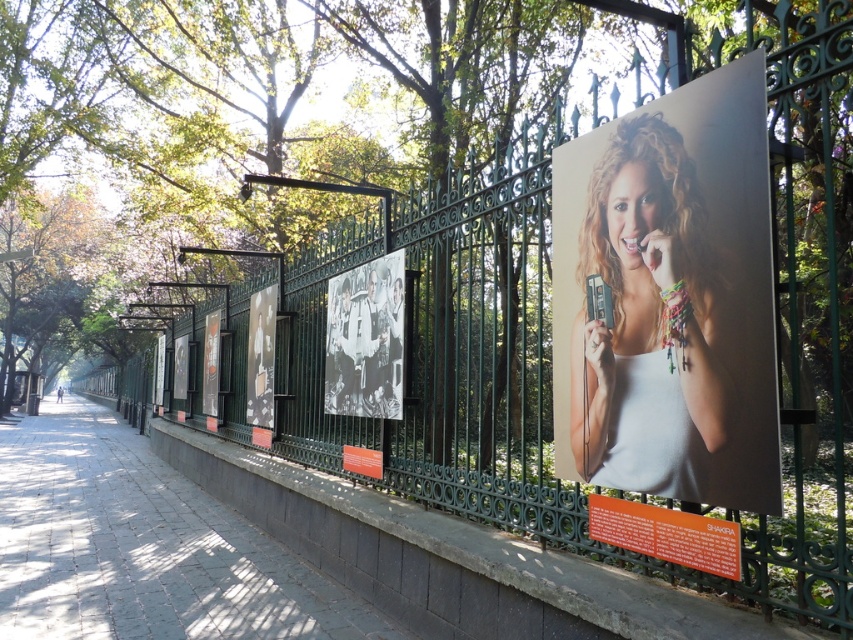
You are a photographer trying to capture the matte white tank top at center and the paved stone sidewalk at center in a single shot. Based on their positions, which object should you focus on first to ensure both are in clear view?

The matte white tank top at center is above the paved stone sidewalk at center, so you should focus on the matte white tank top at center first to ensure both are in clear view.

You are standing at the center of the pathway in the outdoor exhibit. You notice two points marked on the ground ahead of you. The first point is at coordinates point (712, 502) and the second is at point (103, 560). Which point is closer to you?

Point (712, 502) is closer to the viewer than point (103, 560).